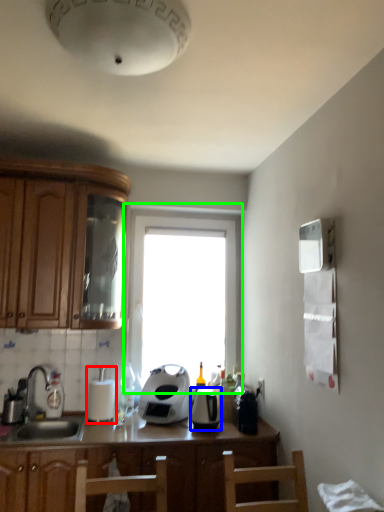
Question: Considering the real-world distances, which object is farthest from appliance (highlighted by a red box)? kitchen appliance (highlighted by a blue box) or window (highlighted by a green box)?

Choices:
 (A) kitchen appliance
 (B) window

Answer: (B)